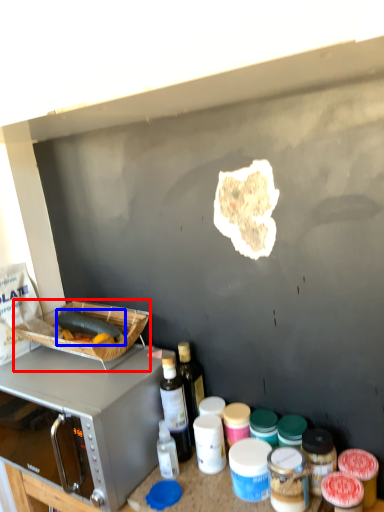
Question: Which object appears farthest to the camera in this image, appliance (highlighted by a red box) or food (highlighted by a blue box)?

Choices:
 (A) appliance
 (B) food

Answer: (B)